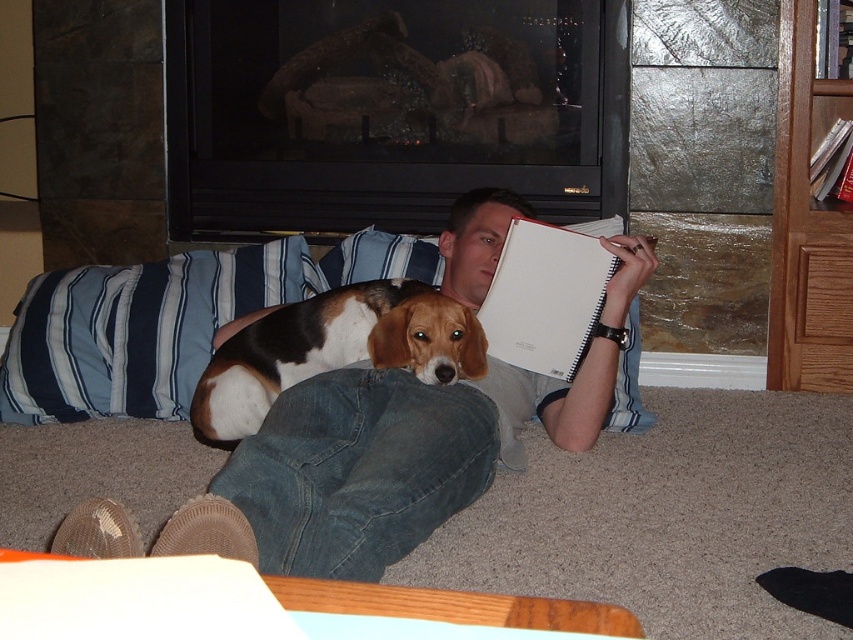
From the picture: You are a photographer trying to capture a closeup of the blue striped pillow at left without including the denim jeans at center in the frame. Is this possible given their positions?

The denim jeans at center is closer to the viewer than the blue striped pillow at left, so it would block the view of the blue striped pillow at left. Therefore, capturing a closeup of the blue striped pillow at left without including the denim jeans at center is not possible.

You are standing in the living room and want to place a 1 meter long decorative mat between yourself and the denim jeans at center. Is there enough space to fit the mat without overlapping?

The distance between the denim jeans at center and the viewer is 86.76 centimeters. Since the mat is 1 meter long, which is longer than the available space, it won

You are planning to place the white matte notebook at center on top of the blue striped pillow at left. Based on their sizes, will the notebook fit entirely on the pillow without hanging off the edges?

The blue striped pillow at left is wider than the white matte notebook at center, so the notebook should fit entirely on the pillow without any part hanging off the edges.